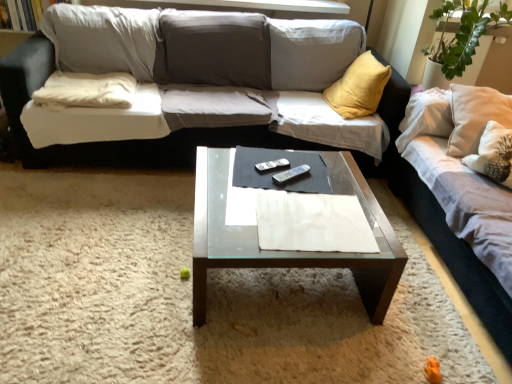
Question: Would you say white soft pillow at left is outside transparent glass coffee table at center?

Choices:
 (A) yes
 (B) no

Answer: (A)

Question: Is white soft pillow at left to the left of transparent glass coffee table at center from the viewer's perspective?

Choices:
 (A) yes
 (B) no

Answer: (A)

Question: From a real-world perspective, is white soft pillow at left on transparent glass coffee table at center?

Choices:
 (A) yes
 (B) no

Answer: (A)

Question: Does white soft pillow at left have a greater width compared to transparent glass coffee table at center?

Choices:
 (A) no
 (B) yes

Answer: (A)

Question: From the image's perspective, is white soft pillow at left above transparent glass coffee table at center?

Choices:
 (A) yes
 (B) no

Answer: (A)

Question: Considering the positions of point (257, 165) and point (440, 238), is point (257, 165) closer or farther from the camera than point (440, 238)?

Choices:
 (A) farther
 (B) closer

Answer: (B)

Question: In the image, is silver metallic remote at center, marked as the 1th remote in a top-to-bottom arrangement, on the left side or the right side of light beige fabric couch at right, positioned as the second studio couch in left-to-right order?

Choices:
 (A) right
 (B) left

Answer: (B)

Question: Considering their positions, is silver metallic remote at center, marked as the 2th remote in a bottom-to-top arrangement, located in front of or behind light beige fabric couch at right, the 1th studio couch from the right?

Choices:
 (A) front
 (B) behind

Answer: (B)

Question: Is silver metallic remote at center, marked as the 1th remote in a top-to-bottom arrangement, inside the boundaries of light beige fabric couch at right, positioned as the second studio couch in left-to-right order, or outside?

Choices:
 (A) outside
 (B) inside

Answer: (A)

Question: Based on their sizes in the image, would you say light beige fabric couch at right, positioned as the second studio couch in left-to-right order, is bigger or smaller than white fabric couch at center, placed as the 1th studio couch when sorted from left to right?

Choices:
 (A) small
 (B) big

Answer: (A)

Question: Is point (484, 312) closer or farther from the camera than point (22, 82)?

Choices:
 (A) farther
 (B) closer

Answer: (B)

Question: Considering their positions, is light beige fabric couch at right, the 1th studio couch from the right, located in front of or behind white fabric couch at center, positioned as the second studio couch in right-to-left order?

Choices:
 (A) behind
 (B) front

Answer: (B)

Question: From the image's perspective, relative to white fabric couch at center, positioned as the second studio couch in right-to-left order, is light beige fabric couch at right, positioned as the second studio couch in left-to-right order, above or below?

Choices:
 (A) below
 (B) above

Answer: (A)

Question: In the image, is transparent glass coffee table at center positioned in front of or behind white fabric couch at center, positioned as the second studio couch in right-to-left order?

Choices:
 (A) behind
 (B) front

Answer: (B)

Question: Is transparent glass coffee table at center situated inside white fabric couch at center, positioned as the second studio couch in right-to-left order, or outside?

Choices:
 (A) outside
 (B) inside

Answer: (A)